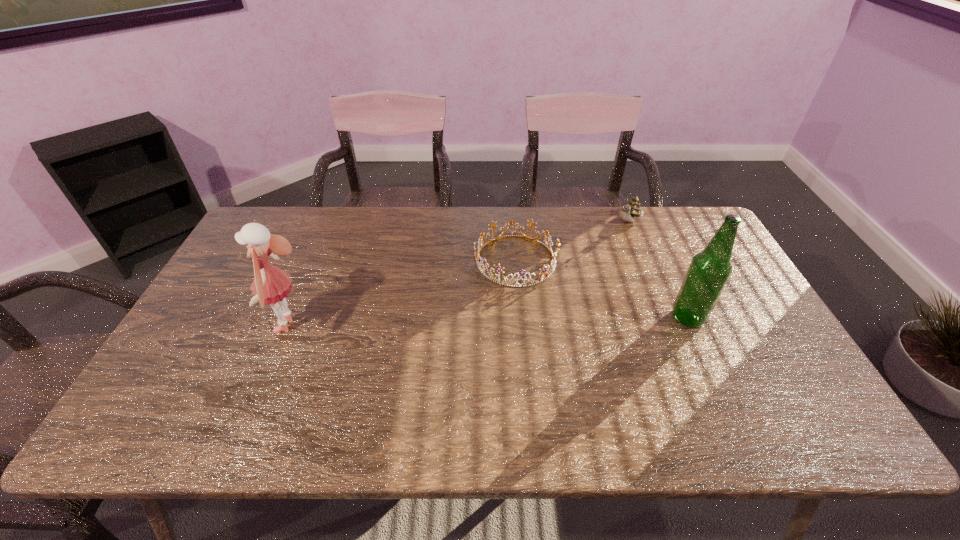
The image size is (960, 540). What are the coordinates of `free spot that satisfies the following two spatial constraints: 1. on the back side of the second shortest object; 2. on the left side of the second object from left to right` in the screenshot? It's located at (513, 221).

Locate an element on the screen. The width and height of the screenshot is (960, 540). free spot that satisfies the following two spatial constraints: 1. on the front side of the farthest object; 2. on the label of the beer bottle is located at coordinates (669, 318).

The height and width of the screenshot is (540, 960). I want to click on vacant space that satisfies the following two spatial constraints: 1. on the front side of the beer bottle; 2. on the label of the second object from left to right, so click(x=521, y=318).

What are the coordinates of `free space that satisfies the following two spatial constraints: 1. on the front side of the beer bottle; 2. on the label of the snail` in the screenshot? It's located at (669, 318).